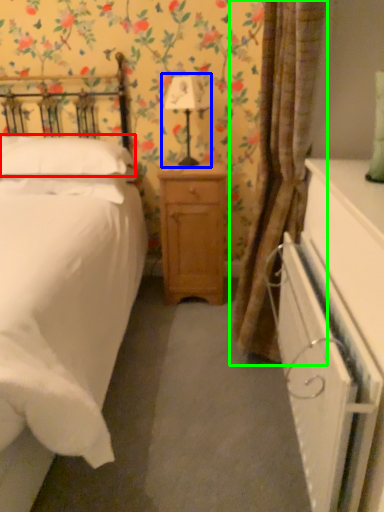
Question: Which object is the closest to the pillow (highlighted by a red box)? Choose among these: bedside lamp (highlighted by a blue box) or curtain (highlighted by a green box).

Choices:
 (A) bedside lamp
 (B) curtain

Answer: (A)